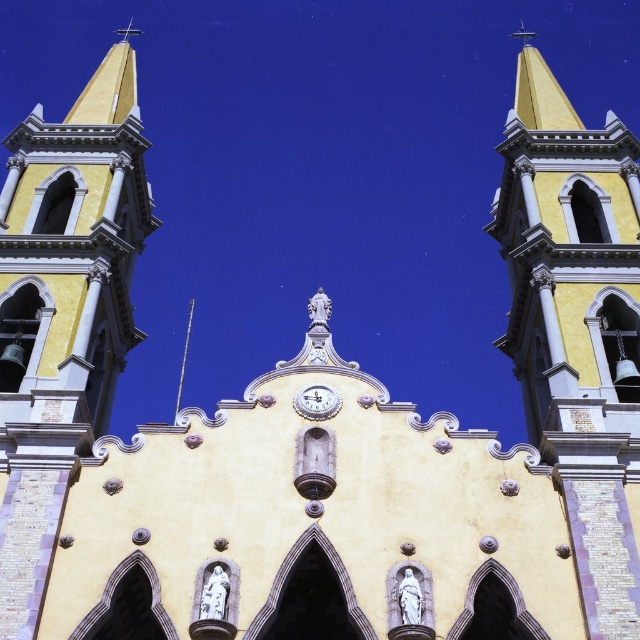
Where is `smooth yellow steeple at upper center`? The height and width of the screenshot is (640, 640). smooth yellow steeple at upper center is located at coordinates (577, 324).

Is the position of smooth yellow steeple at upper center more distant than that of yellow stucco bell tower at left?

Yes, it is.

Where is `smooth yellow steeple at upper center`? The image size is (640, 640). smooth yellow steeple at upper center is located at coordinates (577, 324).

Can you confirm if yellow stucco bell tower at left is shorter than white glossy clock at center?

No, yellow stucco bell tower at left is not shorter than white glossy clock at center.

The width and height of the screenshot is (640, 640). Describe the element at coordinates (64, 310) in the screenshot. I see `yellow stucco bell tower at left` at that location.

Find the location of a particular element. yellow stucco bell tower at left is located at coordinates (64, 310).

Who is lower down, yellow stucco bell tower at left or shiny silver spire at center?

Positioned lower is shiny silver spire at center.

Between yellow stucco bell tower at left and shiny silver spire at center, which one has less height?

shiny silver spire at center is shorter.

What do you see at coordinates (64, 310) in the screenshot?
I see `yellow stucco bell tower at left` at bounding box center [64, 310].

This screenshot has height=640, width=640. Find the location of `yellow stucco bell tower at left`. yellow stucco bell tower at left is located at coordinates (64, 310).